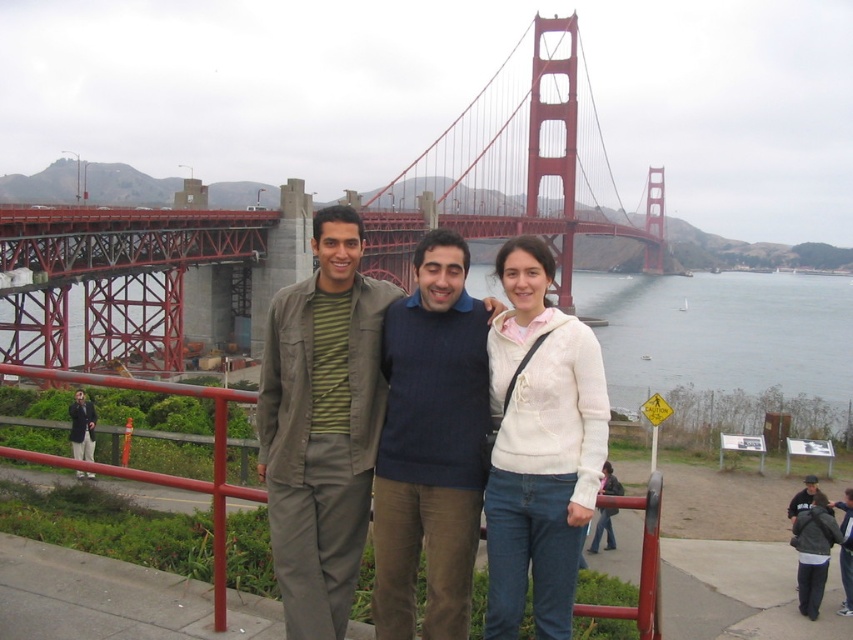
Question: Does matte green shirt at center appear on the left side of dark gray hoodie at center?

Choices:
 (A) yes
 (B) no

Answer: (A)

Question: Does white knit sweater at center have a larger size compared to dark gray hoodie at center?

Choices:
 (A) yes
 (B) no

Answer: (A)

Question: Can you confirm if red steel bridge at center is positioned below white knit sweater at center?

Choices:
 (A) yes
 (B) no

Answer: (B)

Question: Which object is closer to the camera taking this photo?

Choices:
 (A) green striped shirt at center
 (B) red steel bridge at center
 (C) white knit sweater at center
 (D) red metal railing at center

Answer: (A)

Question: Based on their relative distances, which object is nearer to the red steel bridge at center?

Choices:
 (A) matte green shirt at center
 (B) white knit sweater at center
 (C) red metal railing at center
 (D) dark gray hoodie at center

Answer: (A)

Question: Which of these objects is positioned closest to the green striped shirt at center?

Choices:
 (A) white knit sweater at center
 (B) matte green shirt at center
 (C) red metal railing at center
 (D) dark gray hoodie at center

Answer: (B)